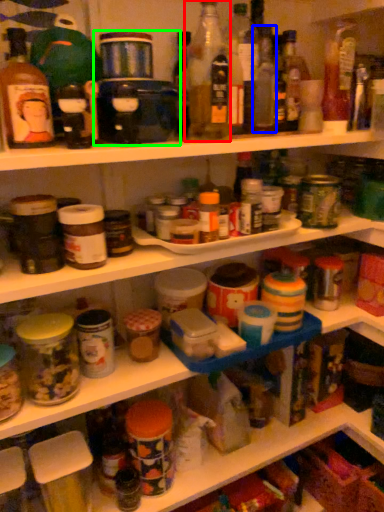
Question: Considering the real-world distances, which object is closest to bottle (highlighted by a red box)? bottle (highlighted by a blue box) or appliance (highlighted by a green box).

Choices:
 (A) bottle
 (B) appliance

Answer: (A)